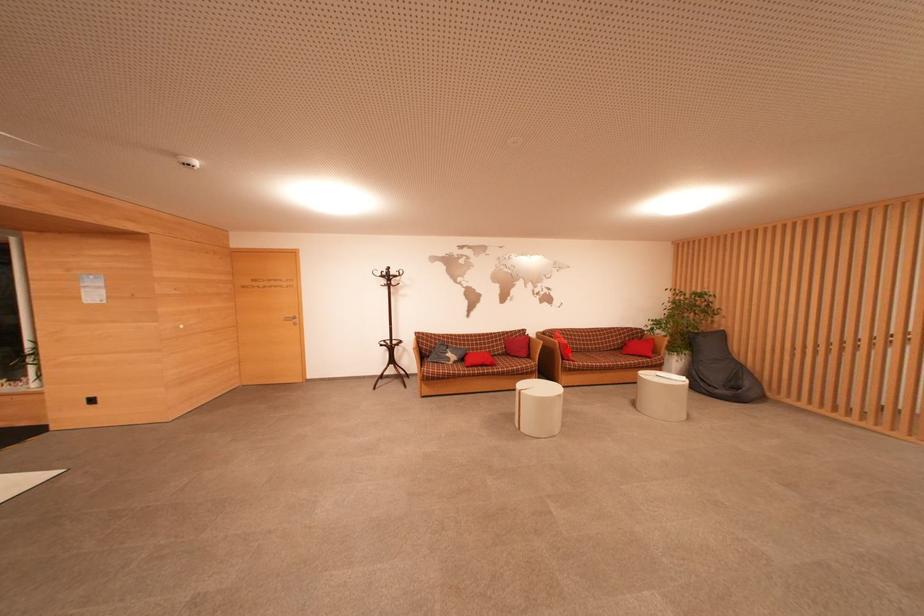
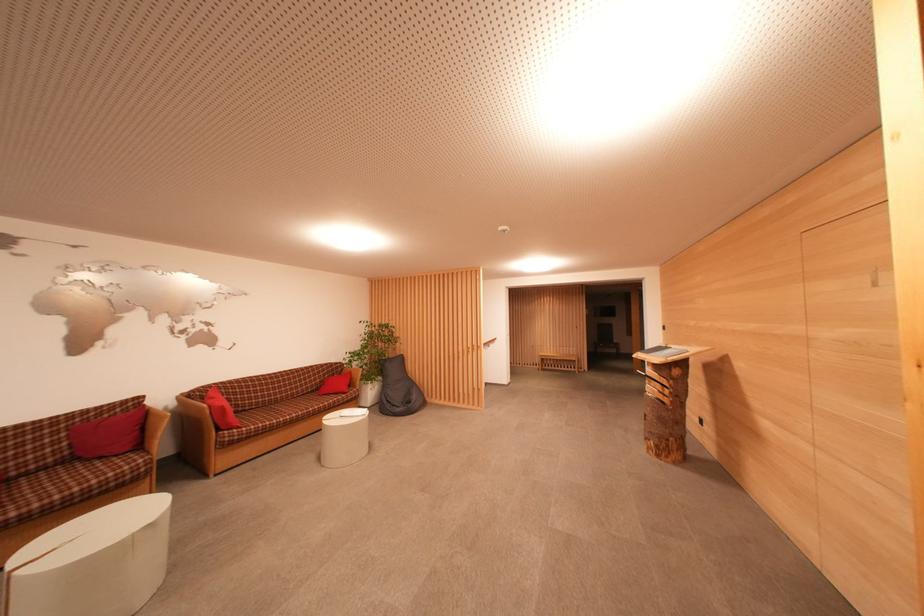
Find the pixel in the second image that matches the highlighted location in the first image.

(223, 416)